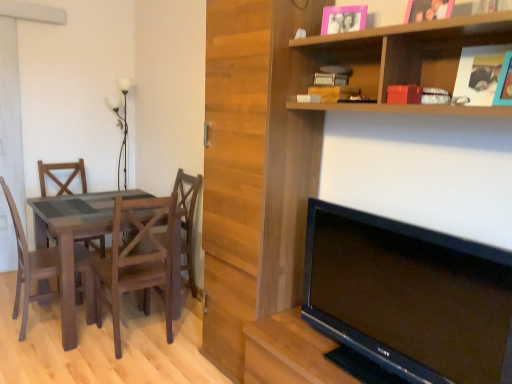
Locate an element on the screen. This screenshot has height=384, width=512. black glossy tv at lower right is located at coordinates (409, 296).

The image size is (512, 384). What do you see at coordinates (409, 296) in the screenshot?
I see `black glossy tv at lower right` at bounding box center [409, 296].

The width and height of the screenshot is (512, 384). What do you see at coordinates (343, 19) in the screenshot?
I see `pink plastic picture frame at upper center, positioned as the 2th picture frame in front-to-back order` at bounding box center [343, 19].

Locate an element on the screen. This screenshot has height=384, width=512. wooden shelf at upper right is located at coordinates (403, 57).

Where is `white glass lamp at upper left`? white glass lamp at upper left is located at coordinates (122, 126).

This screenshot has height=384, width=512. In order to click on wooden textured chair at left, acting as the second chair starting from the left in this screenshot , I will do `click(137, 261)`.

Which point is more forward, (484, 42) or (439, 242)?

The point (439, 242) is closer to the camera.

From their relative heights in the image, would you say wooden shelf at upper right is taller or shorter than black glossy tv at lower right?

Considering their sizes, wooden shelf at upper right has less height than black glossy tv at lower right.

Looking at this image, from a real-world perspective, is wooden shelf at upper right physically located above or below black glossy tv at lower right?

From a real-world perspective, wooden shelf at upper right is physically above black glossy tv at lower right.

Identify the location of shelf lying above the black glossy tv at lower right (from the image's perspective). This screenshot has height=384, width=512. (403, 57).

Is black glossy tv at lower right not close to wooden shelf at upper right?

No, black glossy tv at lower right is in close proximity to wooden shelf at upper right.

Consider the image. From a real-world perspective, which object stands above the other?

wooden shelf at upper right is physically above.

Identify the location of shelf above the black glossy tv at lower right (from a real-world perspective). (403, 57).

Which object is thinner, black glossy tv at lower right or pink matte picture frame at upper center, the first picture frame in the front-to-back sequence?

With smaller width is pink matte picture frame at upper center, the first picture frame in the front-to-back sequence.

Can you tell me how much black glossy tv at lower right and pink matte picture frame at upper center, which is counted as the second picture frame, starting from the left, differ in facing direction?

The facing directions of black glossy tv at lower right and pink matte picture frame at upper center, which is counted as the second picture frame, starting from the left, are 2.04 degrees apart.

Considering the sizes of objects black glossy tv at lower right and pink matte picture frame at upper center, which is counted as the second picture frame, starting from the left, in the image provided, who is bigger, black glossy tv at lower right or pink matte picture frame at upper center, which is counted as the second picture frame, starting from the left,?

black glossy tv at lower right.

Is black glossy tv at lower right placed right next to pink matte picture frame at upper center, which is counted as the 2th picture frame, starting from the back?

No, black glossy tv at lower right is not touching pink matte picture frame at upper center, which is counted as the 2th picture frame, starting from the back.

In the scene shown: Is wooden shelf at upper right inside the boundaries of wooden chair at left, arranged as the 3th chair when viewed from the right, or outside?

wooden shelf at upper right cannot be found inside wooden chair at left, arranged as the 3th chair when viewed from the right.

Considering the relative sizes of wooden shelf at upper right and wooden chair at left, arranged as the 3th chair when viewed from the right, in the image provided, is wooden shelf at upper right wider than wooden chair at left, arranged as the 3th chair when viewed from the right,?

No.

Who is taller, wooden shelf at upper right or wooden chair at left, arranged as the 3th chair when viewed from the right?

Standing taller between the two is wooden chair at left, arranged as the 3th chair when viewed from the right.

Which of these two, wooden shelf at upper right or wooden chair at center, the first chair positioned from the right, is thinner?

With smaller width is wooden shelf at upper right.

Based on their positions, is wooden shelf at upper right located to the left or right of wooden chair at center, placed as the 3th chair when sorted from left to right?

wooden shelf at upper right is to the right of wooden chair at center, placed as the 3th chair when sorted from left to right.

Can you tell me how much wooden shelf at upper right and wooden chair at center, the first chair positioned from the right, differ in facing direction?

1.46 degrees separate the facing orientations of wooden shelf at upper right and wooden chair at center, the first chair positioned from the right.

Considering the sizes of objects wooden shelf at upper right and wooden chair at center, placed as the 3th chair when sorted from left to right, in the image provided, who is bigger, wooden shelf at upper right or wooden chair at center, placed as the 3th chair when sorted from left to right,?

wooden chair at center, placed as the 3th chair when sorted from left to right.

Can you see pink matte picture frame at upper center, the first picture frame in the front-to-back sequence, touching wooden textured chair at left, acting as the second chair starting from the left?

No.

Which object is closer to the camera taking this photo, pink matte picture frame at upper center, which is counted as the 2th picture frame, starting from the back, or wooden textured chair at left, positioned as the 2th chair in right-to-left order?

pink matte picture frame at upper center, which is counted as the 2th picture frame, starting from the back, is closer to the camera.

From the image's perspective, which picture frame is the 1st one above the wooden textured chair at left, acting as the second chair starting from the left? Please provide its 2D coordinates.

[(428, 10)]

What's the angular difference between pink matte picture frame at upper center, the first picture frame in the front-to-back sequence, and wooden textured chair at left, acting as the second chair starting from the left,'s facing directions?

The facing directions of pink matte picture frame at upper center, the first picture frame in the front-to-back sequence, and wooden textured chair at left, acting as the second chair starting from the left, are 94.9 degrees apart.

Are wooden chair at left, arranged as the 3th chair when viewed from the right, and wooden book at upper center beside each other?

wooden chair at left, arranged as the 3th chair when viewed from the right, is not next to wooden book at upper center, and they're not touching.

Is wooden chair at left, arranged as the 3th chair when viewed from the right, oriented away from wooden book at upper center?

wooden chair at left, arranged as the 3th chair when viewed from the right, does not have its back to wooden book at upper center.

Can you confirm if wooden chair at left, which appears as the first chair when viewed from the left, is smaller than wooden book at upper center?

No, wooden chair at left, which appears as the first chair when viewed from the left, is not smaller than wooden book at upper center.

Find the location of a particular element. shelf behind the black glossy tv at lower right is located at coordinates (403, 57).

Where is `television that appears in front of the wooden shelf at upper right`? The width and height of the screenshot is (512, 384). television that appears in front of the wooden shelf at upper right is located at coordinates (409, 296).

From the image, which object appears to be farther from wooden chair at center, placed as the 3th chair when sorted from left to right, wooden shelf at upper right or wooden textured chair at left, positioned as the 2th chair in right-to-left order?

wooden shelf at upper right.

From the image, which object appears to be nearer to wooden chair at center, placed as the 3th chair when sorted from left to right, black glossy tv at lower right or matte wood table at left?

Among the two, matte wood table at left is located nearer to wooden chair at center, placed as the 3th chair when sorted from left to right.

When comparing their distances from pink plastic picture frame at upper center, which is counted as the first picture frame, starting from the back, does wooden book at upper center or wooden chair at center, the first chair positioned from the right, seem closer?

The object closer to pink plastic picture frame at upper center, which is counted as the first picture frame, starting from the back, is wooden book at upper center.

When comparing their distances from wooden shelf at upper right, does matte wood table at left or pink plastic picture frame at upper center, positioned as the 2th picture frame in front-to-back order, seem further?

matte wood table at left lies further to wooden shelf at upper right than the other object.

Looking at the image, which one is located further to wooden textured chair at left, positioned as the 2th chair in right-to-left order, white glass lamp at upper left or pink plastic picture frame at upper center, positioned as the 2th picture frame in front-to-back order?

Among the two, white glass lamp at upper left is located further to wooden textured chair at left, positioned as the 2th chair in right-to-left order.

Estimate the real-world distances between objects in this image. Which object is further from wooden chair at left, which appears as the first chair when viewed from the left, pink matte picture frame at upper center, which is counted as the 2th picture frame, starting from the back, or wooden book at upper center?

pink matte picture frame at upper center, which is counted as the 2th picture frame, starting from the back, lies further to wooden chair at left, which appears as the first chair when viewed from the left, than the other object.

Looking at the image, which one is located closer to wooden book at upper center, black glossy tv at lower right or wooden shelf at upper right?

The object closer to wooden book at upper center is wooden shelf at upper right.

Based on their spatial positions, is pink plastic picture frame at upper center, which is counted as the first picture frame, starting from the left, or wooden book at upper center closer to matte wood table at left?

Among the two, wooden book at upper center is located nearer to matte wood table at left.

Locate an element on the screen. book between black glossy tv at lower right and wooden chair at center, placed as the 3th chair when sorted from left to right, along the z-axis is located at coordinates (332, 75).

The height and width of the screenshot is (384, 512). Identify the location of picture frame between wooden textured chair at left, acting as the second chair starting from the left, and pink matte picture frame at upper center, arranged as the 1th picture frame when viewed from the right. (343, 19).

Where is `book between wooden chair at left, arranged as the 3th chair when viewed from the right, and black glossy tv at lower right, in the horizontal direction`? Image resolution: width=512 pixels, height=384 pixels. book between wooden chair at left, arranged as the 3th chair when viewed from the right, and black glossy tv at lower right, in the horizontal direction is located at coordinates (332, 75).

Locate an element on the screen. kitchen & dining room table between white glass lamp at upper left and wooden book at upper center is located at coordinates (73, 238).